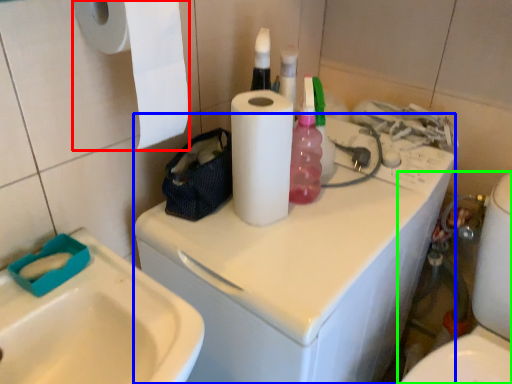
Question: Considering the real-world distances, which object is closest to paper towel (highlighted by a red box)? washing machine (highlighted by a blue box) or toilet (highlighted by a green box).

Choices:
 (A) washing machine
 (B) toilet

Answer: (A)